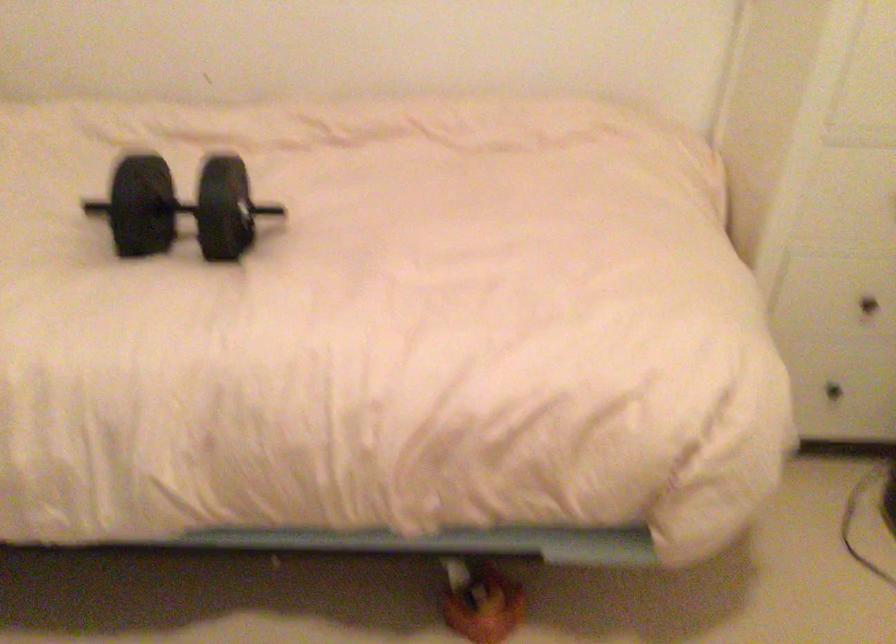
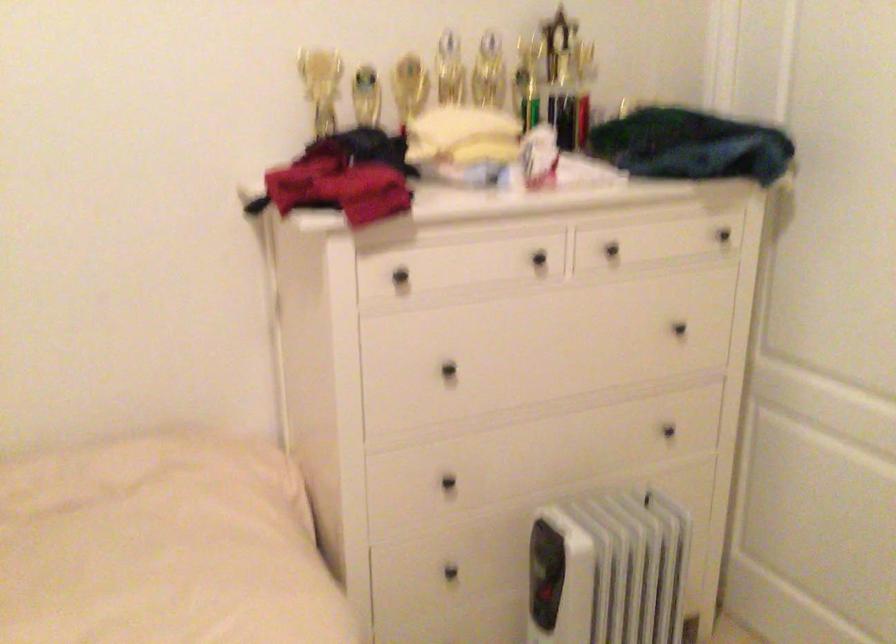
Question: The camera is either moving clockwise (left) or counter-clockwise (right) around the object. The first image is from the beginning of the video and the second image is from the end. Is the camera moving left or right when shooting the video?

Choices:
 (A) Left
 (B) Right

Answer: (A)